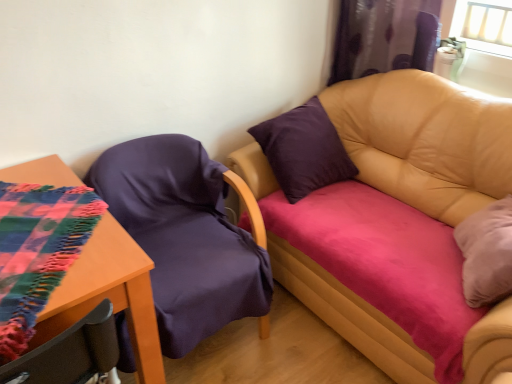
Question: Looking at their shapes, would you say wooden table at lower left is wider or thinner than leather couch at upper right?

Choices:
 (A) thin
 (B) wide

Answer: (A)

Question: Looking at the image, does wooden table at lower left seem bigger or smaller compared to leather couch at upper right?

Choices:
 (A) small
 (B) big

Answer: (A)

Question: Which of these objects is positioned farthest from the purple satin curtain at upper right?

Choices:
 (A) wooden table at lower left
 (B) leather couch at upper right
 (C) purple fabric chair at left

Answer: (A)

Question: Based on their relative distances, which object is nearer to the leather couch at upper right?

Choices:
 (A) purple satin curtain at upper right
 (B) purple fabric chair at left
 (C) wooden table at lower left

Answer: (A)